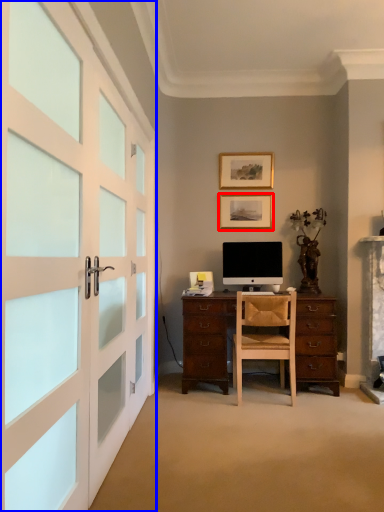
Question: Which object is further to the camera taking this photo, picture frame (highlighted by a red box) or garage door (highlighted by a blue box)?

Choices:
 (A) picture frame
 (B) garage door

Answer: (A)